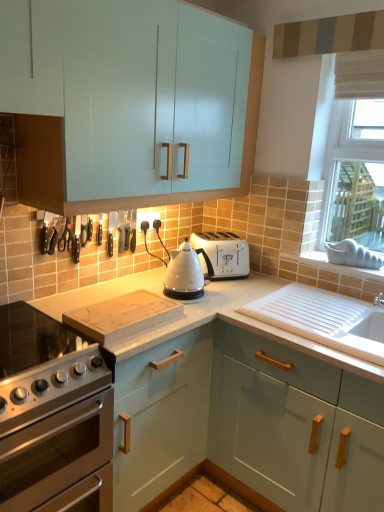
I want to click on vacant area that lies to the right of white glossy kettle at center, so click(229, 297).